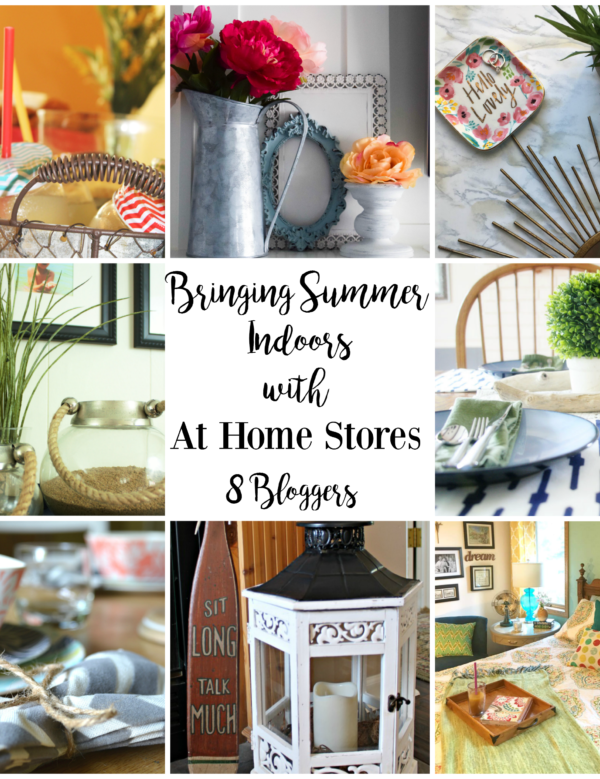
The width and height of the screenshot is (600, 779). In order to click on glass of iced coffee in this screenshot , I will do `click(475, 700)`.